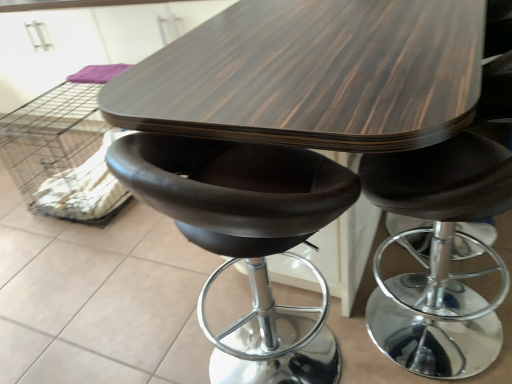
Question: Does dark wood table at center have a greater width compared to matte black stool at center?

Choices:
 (A) yes
 (B) no

Answer: (A)

Question: Considering the relative sizes of dark wood table at center and matte black stool at center in the image provided, is dark wood table at center smaller than matte black stool at center?

Choices:
 (A) yes
 (B) no

Answer: (B)

Question: Is dark wood table at center turned away from matte black stool at center?

Choices:
 (A) yes
 (B) no

Answer: (B)

Question: Does dark wood table at center touch matte black stool at center?

Choices:
 (A) yes
 (B) no

Answer: (B)

Question: Can you confirm if dark wood table at center is positioned to the right of matte black stool at center?

Choices:
 (A) no
 (B) yes

Answer: (B)

Question: Considering the positions of dark wood table at center and matte black stool at center in the image, is dark wood table at center wider or thinner than matte black stool at center?

Choices:
 (A) wide
 (B) thin

Answer: (A)

Question: In the image, is dark wood table at center positioned in front of or behind matte black stool at center?

Choices:
 (A) front
 (B) behind

Answer: (B)

Question: From a real-world perspective, is dark wood table at center positioned above or below matte black stool at center?

Choices:
 (A) above
 (B) below

Answer: (B)

Question: From the image's perspective, relative to matte black stool at center, is dark wood table at center above or below?

Choices:
 (A) below
 (B) above

Answer: (B)

Question: From a real-world perspective, is white fabric crate at lower left positioned above or below matte black stool at center?

Choices:
 (A) below
 (B) above

Answer: (A)

Question: Visually, is white fabric crate at lower left positioned to the left or to the right of matte black stool at center?

Choices:
 (A) right
 (B) left

Answer: (B)

Question: Considering the positions of white fabric crate at lower left and matte black stool at center in the image, is white fabric crate at lower left taller or shorter than matte black stool at center?

Choices:
 (A) short
 (B) tall

Answer: (A)

Question: Looking at their shapes, would you say white fabric crate at lower left is wider or thinner than matte black stool at center?

Choices:
 (A) wide
 (B) thin

Answer: (A)

Question: Based on their sizes in the image, would you say matte black stool at center is bigger or smaller than white fabric crate at lower left?

Choices:
 (A) small
 (B) big

Answer: (B)

Question: Considering the positions of matte black stool at center and white fabric crate at lower left in the image, is matte black stool at center taller or shorter than white fabric crate at lower left?

Choices:
 (A) tall
 (B) short

Answer: (A)